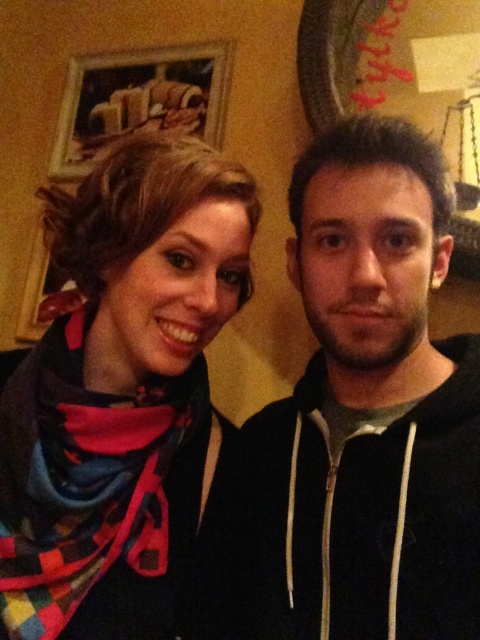
Describe the element at coordinates (84, 480) in the screenshot. This screenshot has width=480, height=640. I see `multicolored woven scarf at left` at that location.

Locate an element on the screen. This screenshot has height=640, width=480. multicolored woven scarf at left is located at coordinates (84, 480).

Where is `multicolored woven scarf at left`? The height and width of the screenshot is (640, 480). multicolored woven scarf at left is located at coordinates (84, 480).